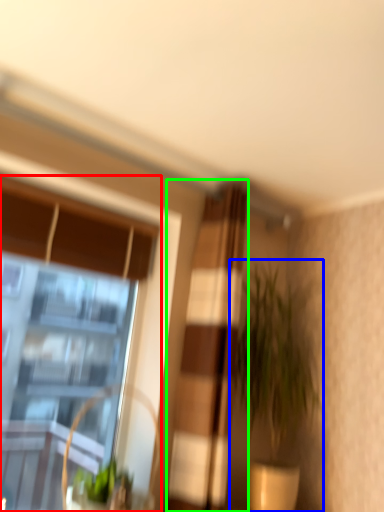
Question: Which is nearer to the window (highlighted by a red box)? houseplant (highlighted by a blue box) or curtain (highlighted by a green box).

Choices:
 (A) houseplant
 (B) curtain

Answer: (A)